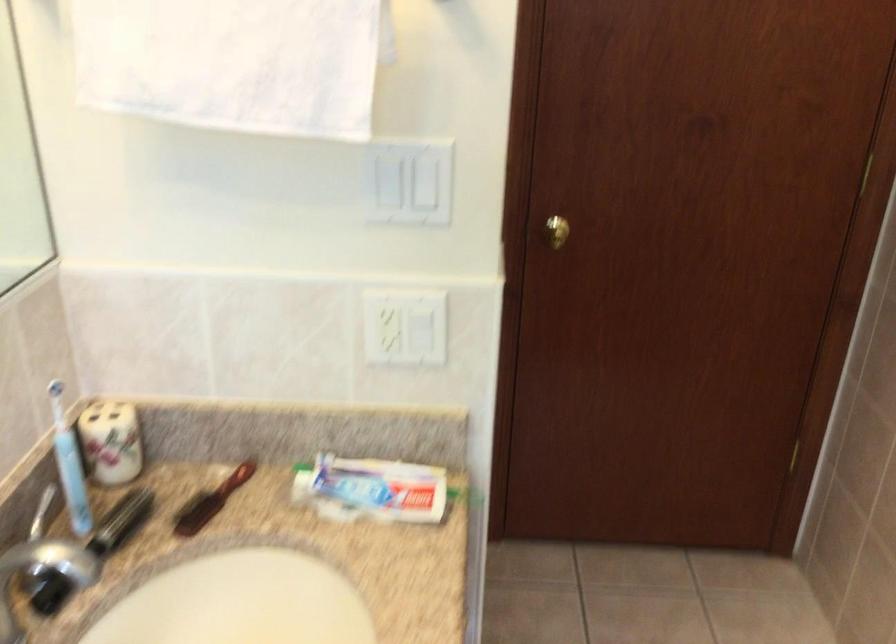
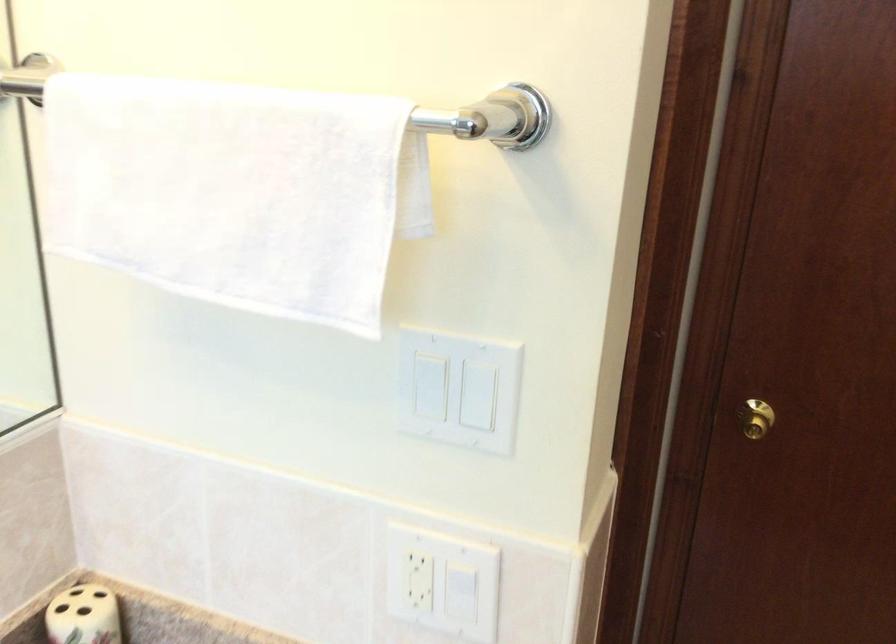
Where in the second image is the point corresponding to the point at 403,181 from the first image?

(458, 389)